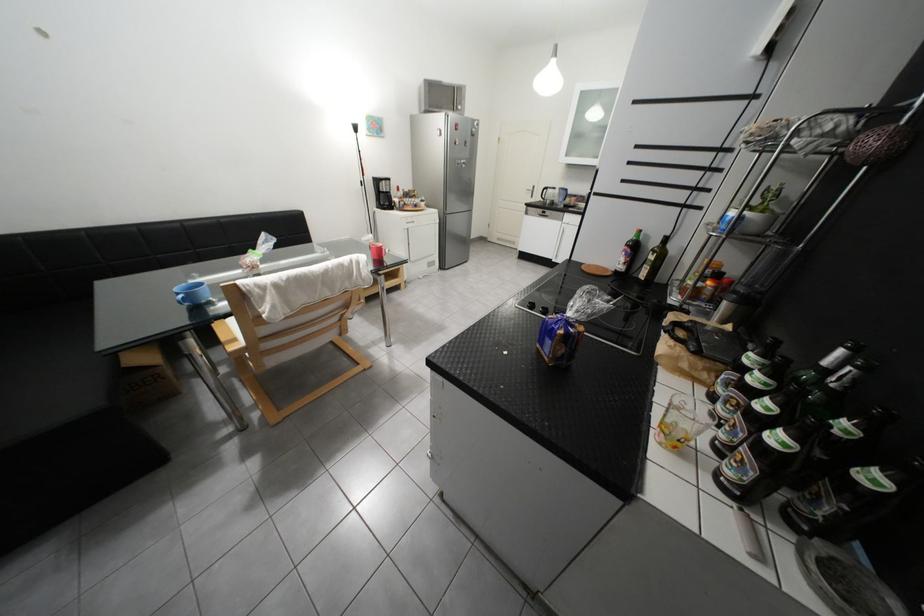
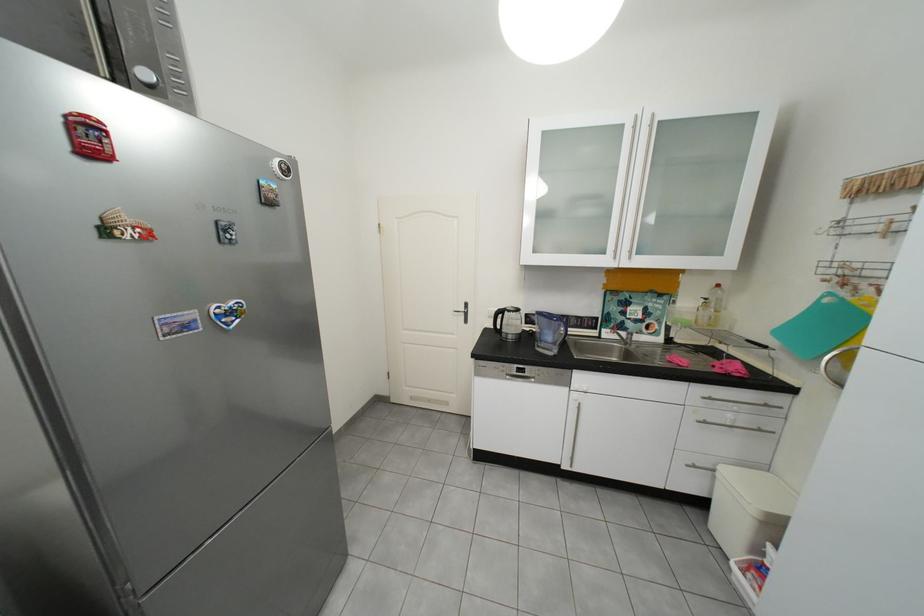
Locate, in the second image, the point that corresponds to (x=470, y=108) in the first image.

(156, 75)